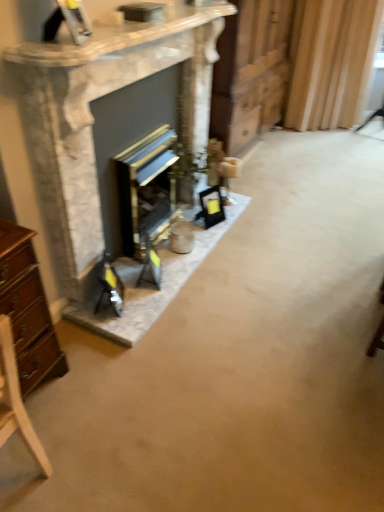
Question: Is marble fireplace at center to the left or to the right of light wood chair at lower left in the image?

Choices:
 (A) left
 (B) right

Answer: (B)

Question: From the image's perspective, is marble fireplace at center located above or below light wood chair at lower left?

Choices:
 (A) above
 (B) below

Answer: (A)

Question: Which object is positioned closest to the gold metallic wood burning stove at center?

Choices:
 (A) wooden at center
 (B) light wood chair at lower left
 (C) marble fireplace at center
 (D) wooden curtain at right
 (E) matte black picture frame at center

Answer: (C)

Question: Which is nearer to the marble fireplace at center?

Choices:
 (A) wooden at center
 (B) light wood chair at lower left
 (C) gold metallic wood burning stove at center
 (D) matte black picture frame at center
 (E) wooden curtain at right

Answer: (C)